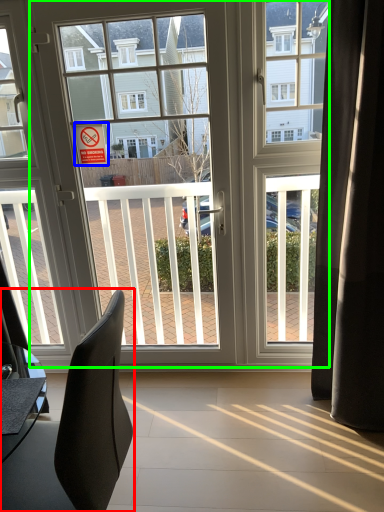
Question: Considering the real-world distances, which object is farthest from chair (highlighted by a red box)? parking sign (highlighted by a blue box) or door (highlighted by a green box)?

Choices:
 (A) parking sign
 (B) door

Answer: (A)